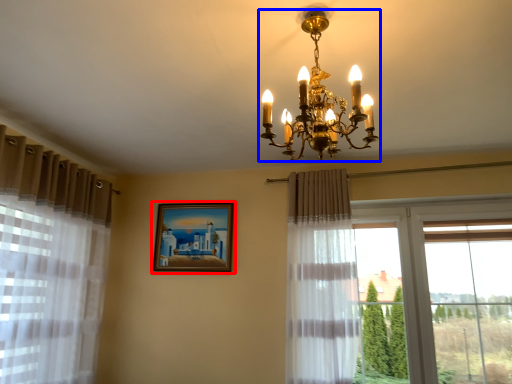
Question: Which of the following is the farthest to the observer, picture frame (highlighted by a red box) or lamp (highlighted by a blue box)?

Choices:
 (A) picture frame
 (B) lamp

Answer: (A)